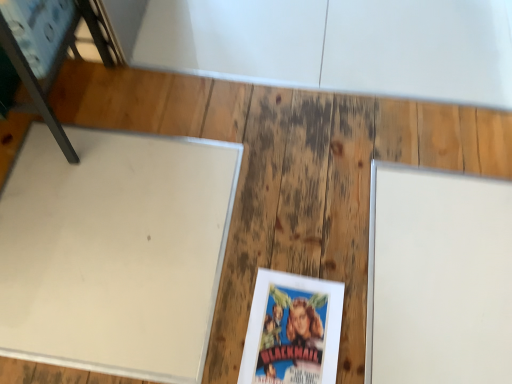
Find the location of a particular element. This screenshot has height=384, width=512. vacant space situated above white matte board at right (from a real-world perspective) is located at coordinates (446, 283).